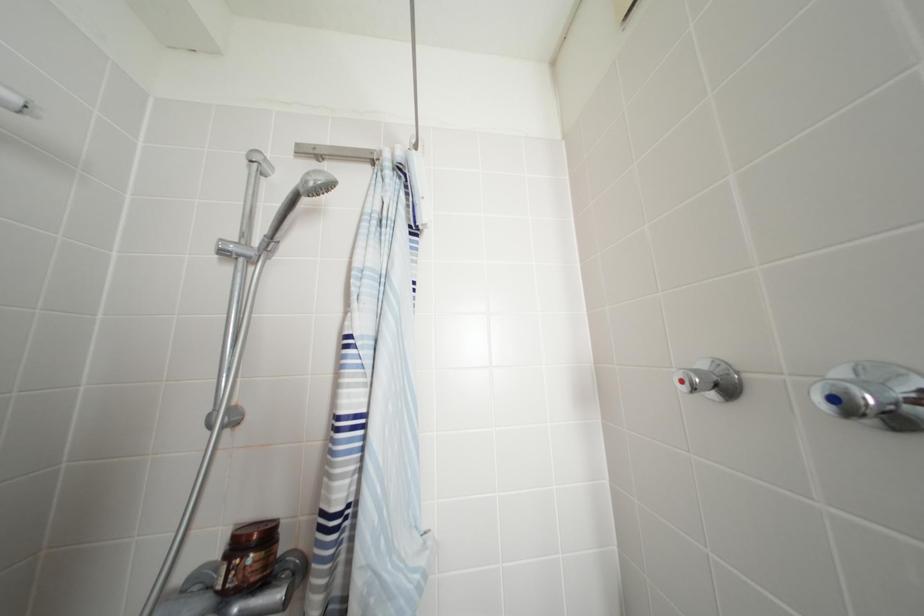
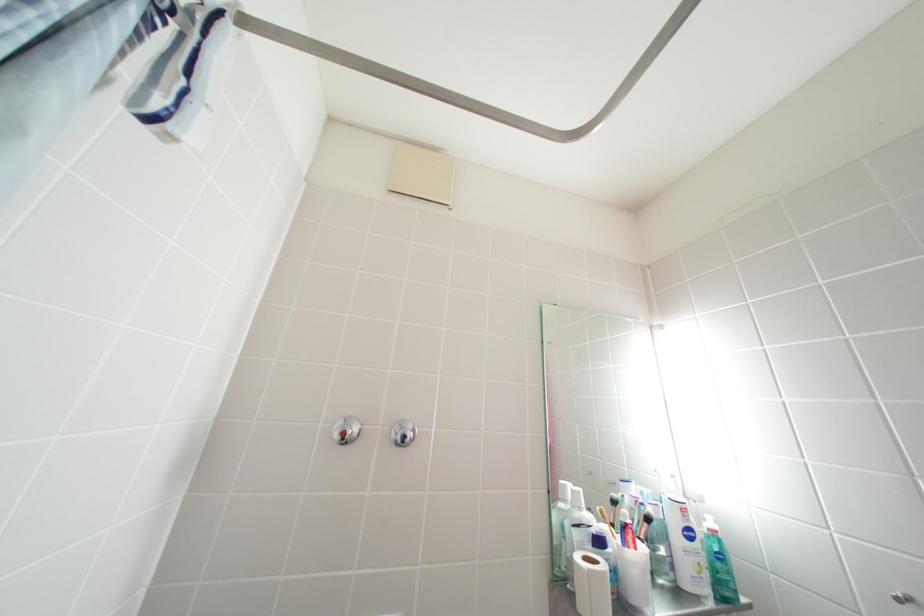
How did the camera likely rotate?

The camera rotated toward right-up.